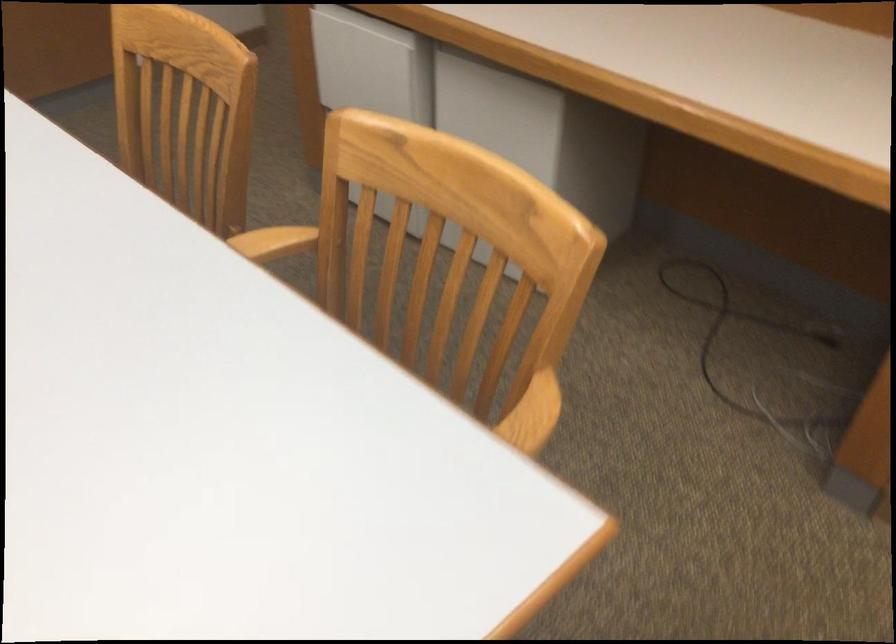
Describe the element at coordinates (442, 232) in the screenshot. I see `the chair sitting surface` at that location.